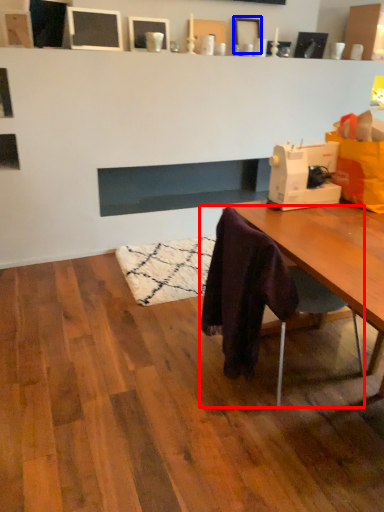
Question: Which point is closer to the camera, chair (highlighted by a red box) or picture frame (highlighted by a blue box)?

Choices:
 (A) chair
 (B) picture frame

Answer: (A)